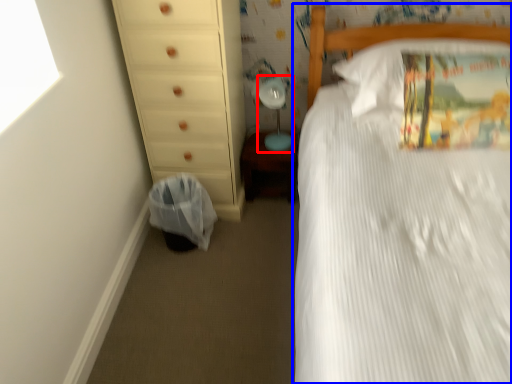
Question: Which of the following is the closest to the observer, table lamp (highlighted by a red box) or bed (highlighted by a blue box)?

Choices:
 (A) table lamp
 (B) bed

Answer: (B)